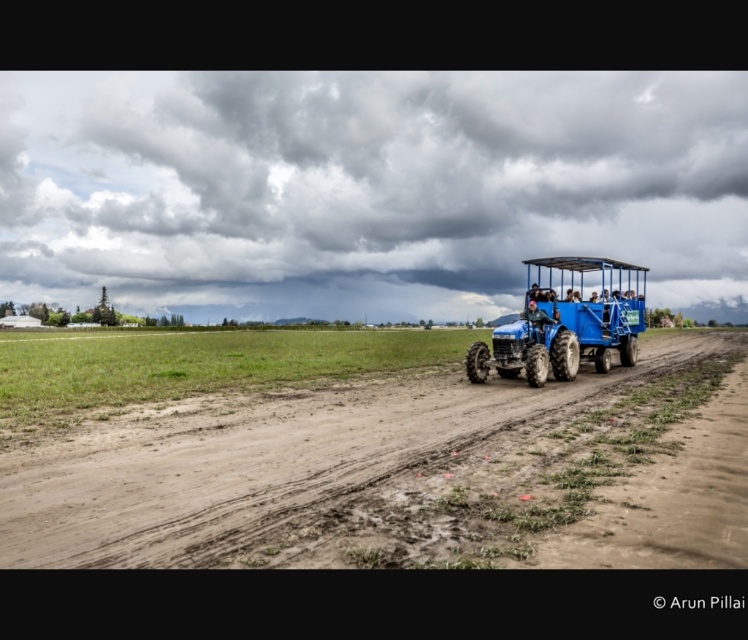
Question: Does dirt field at center appear under blue matte tractor at center?

Choices:
 (A) no
 (B) yes

Answer: (B)

Question: Is dirt field at center thinner than blue matte tractor at center?

Choices:
 (A) no
 (B) yes

Answer: (A)

Question: Can you confirm if dirt field at center is smaller than blue matte tractor at center?

Choices:
 (A) no
 (B) yes

Answer: (B)